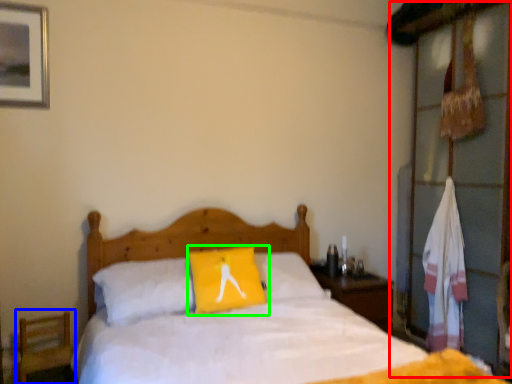
Question: Based on their relative distances, which object is nearer to dresser (highlighted by a red box)? Choose from armchair (highlighted by a blue box) and pillow (highlighted by a green box).

Choices:
 (A) armchair
 (B) pillow

Answer: (B)